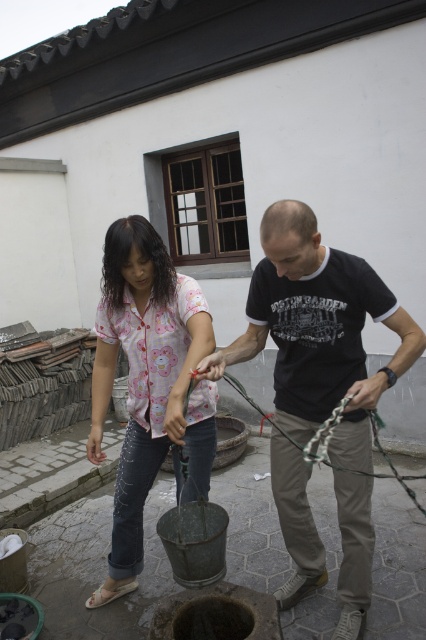
Can you confirm if floral cotton shirt at center is positioned above green rubber rope at center?

Yes, floral cotton shirt at center is above green rubber rope at center.

Which is below, floral cotton shirt at center or green rubber rope at center?

green rubber rope at center

Which is behind, point (103, 394) or point (267, 413)?

The point (267, 413) is behind.

Locate an element on the screen. The image size is (426, 640). floral cotton shirt at center is located at coordinates (149, 384).

Is black cotton shirt at center positioned before smooth concrete well at center?

Yes, black cotton shirt at center is closer to the viewer.

From the picture: Is black cotton shirt at center to the left of smooth concrete well at center from the viewer's perspective?

Indeed, black cotton shirt at center is positioned on the left side of smooth concrete well at center.

Between point (354, 502) and point (51, 538), which one is positioned behind?

The point (51, 538) is behind.

In order to click on black cotton shirt at center in this screenshot , I will do `click(317, 332)`.

Does smooth concrete well at center have a greater height compared to green rubber rope at center?

No.

Locate an element on the screen. This screenshot has width=426, height=640. smooth concrete well at center is located at coordinates (95, 566).

The image size is (426, 640). I want to click on smooth concrete well at center, so click(95, 566).